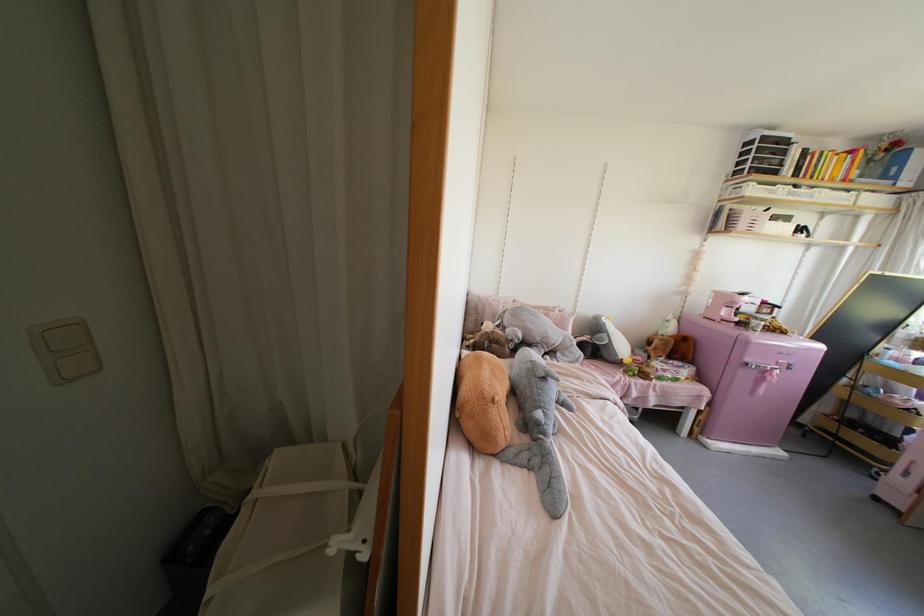
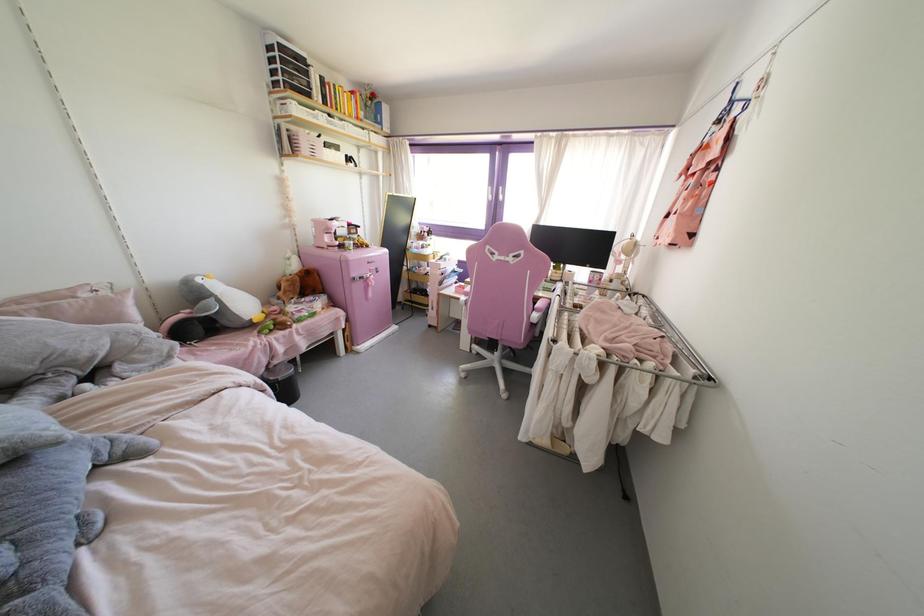
Locate, in the second image, the point that corresponds to pixel 555 310 in the first image.

(83, 294)